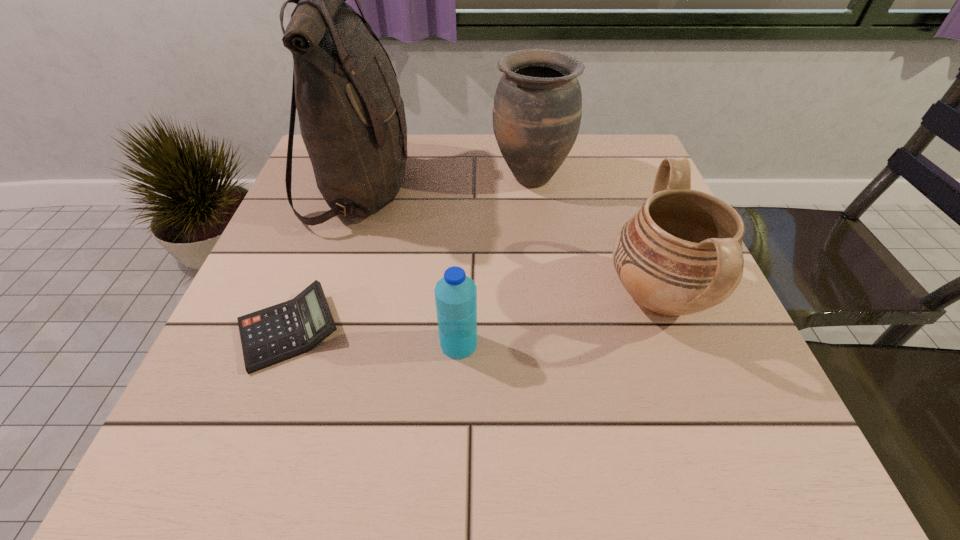
Locate an element on the screen. vacant region between the second tallest object and the nearer urn is located at coordinates (595, 237).

Locate an element on the screen. free space between the fourth shortest object and the shortest object is located at coordinates (410, 254).

Where is `free area in between the rightmost object and the tallest object`? free area in between the rightmost object and the tallest object is located at coordinates (510, 242).

Identify the location of object that ranks as the third closest to the tallest object. This screenshot has height=540, width=960. 455,294.

At what (x,y) coordinates should I click in order to perform the action: click on the second closest object to the shortest object. Please return your answer as a coordinate pair (x, y). Looking at the image, I should click on (455, 294).

Where is `free space that satisfies the following two spatial constraints: 1. on the front side of the taller urn; 2. on the open flap of the backpack`? Image resolution: width=960 pixels, height=540 pixels. free space that satisfies the following two spatial constraints: 1. on the front side of the taller urn; 2. on the open flap of the backpack is located at coordinates (533, 190).

Locate an element on the screen. This screenshot has width=960, height=540. free location that satisfies the following two spatial constraints: 1. on the open flap of the water bottle; 2. on the right side of the backpack is located at coordinates (310, 344).

The image size is (960, 540). What are the coordinates of `free point that satisfies the following two spatial constraints: 1. on the front side of the calculator; 2. on the left side of the water bottle` in the screenshot? It's located at (284, 344).

In order to click on vacant position in the image that satisfies the following two spatial constraints: 1. on the back side of the shortest object; 2. on the left side of the farther urn in this screenshot , I will do `click(347, 177)`.